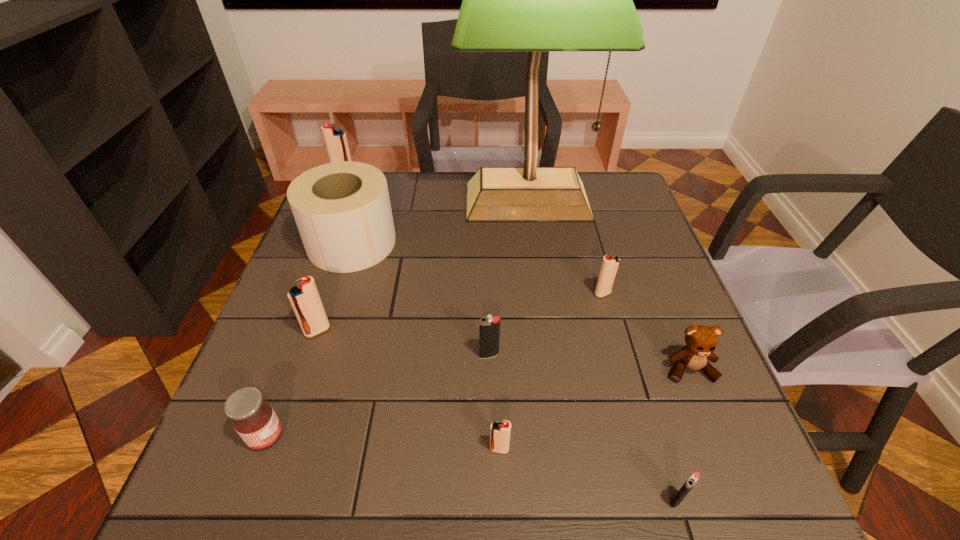
In order to click on green table lamp in this screenshot , I will do `click(534, 0)`.

Identify the location of table lamp. (534, 0).

Where is `the leftmost red igniter`? The image size is (960, 540). the leftmost red igniter is located at coordinates pos(336,143).

Where is `the farthest red igniter`? the farthest red igniter is located at coordinates (336, 143).

Where is `toilet tissue`? toilet tissue is located at coordinates (342, 210).

What are the coordinates of `the sixth nearest object` in the screenshot? It's located at (305, 300).

Find the location of a particular element. This screenshot has height=540, width=960. the fifth igniter from right to left is located at coordinates (305, 300).

Where is `the bigger black igniter`? This screenshot has height=540, width=960. the bigger black igniter is located at coordinates (489, 327).

Locate an element on the screen. the left black igniter is located at coordinates (489, 327).

I want to click on the third biggest red igniter, so click(610, 264).